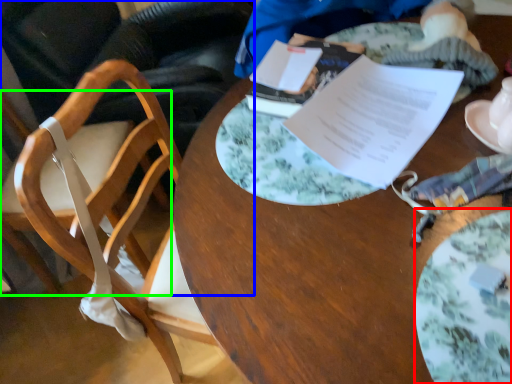
Question: Which object is the closest to the plate (highlighted by a red box)? Choose among these: chair (highlighted by a blue box) or chair (highlighted by a green box).

Choices:
 (A) chair
 (B) chair

Answer: (B)